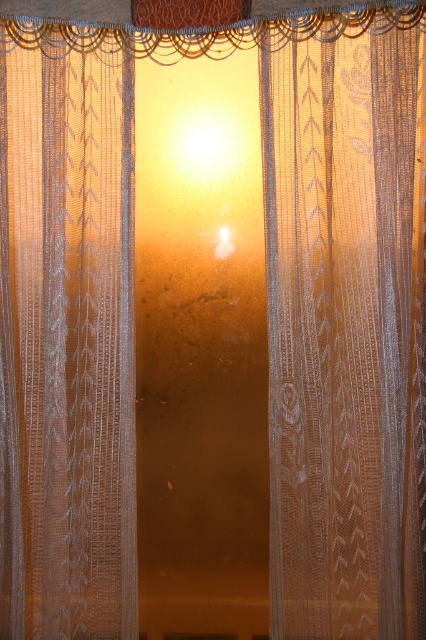
Question: Does white lace curtain at center appear over white lace curtain at left?

Choices:
 (A) yes
 (B) no

Answer: (A)

Question: Can you confirm if white lace curtain at center is thinner than white lace curtain at left?

Choices:
 (A) yes
 (B) no

Answer: (B)

Question: Which object is farther from the camera taking this photo?

Choices:
 (A) white lace curtain at left
 (B) white lace curtain at center

Answer: (A)

Question: Which point is closer to the camera?

Choices:
 (A) white lace curtain at left
 (B) white lace curtain at center

Answer: (B)

Question: Can you confirm if white lace curtain at center is positioned below white lace curtain at left?

Choices:
 (A) no
 (B) yes

Answer: (A)

Question: Which point is closer to the camera taking this photo?

Choices:
 (A) (388, 172)
 (B) (92, 326)

Answer: (A)